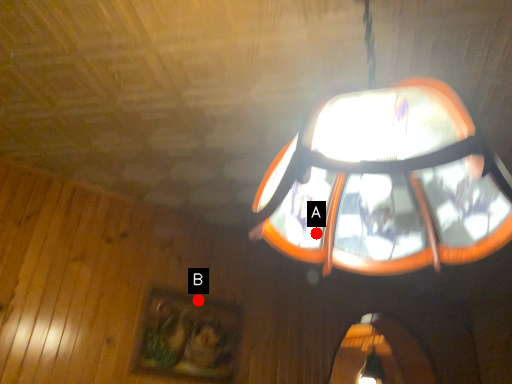
Question: Two points are circled on the image, labeled by A and B beside each circle. Among these points, which one is farthest from the camera?

Choices:
 (A) A is further
 (B) B is further

Answer: (B)